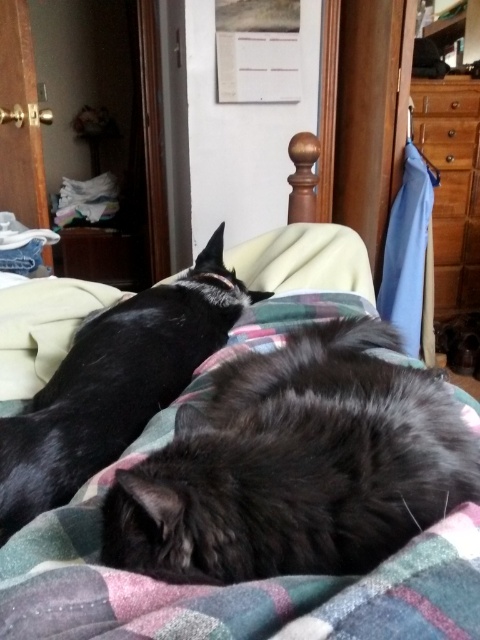
Which is behind, point (109, 516) or point (108, 324)?

Positioned behind is point (108, 324).

Does fluffy black cat at center appear under shiny black cat at left?

Yes, fluffy black cat at center is below shiny black cat at left.

What do you see at coordinates (296, 465) in the screenshot?
I see `fluffy black cat at center` at bounding box center [296, 465].

Locate an element on the screen. Image resolution: width=480 pixels, height=640 pixels. fluffy black cat at center is located at coordinates (296, 465).